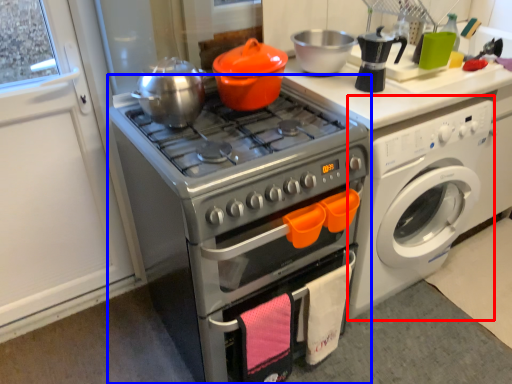
Question: Which of the following is the closest to the observer, washing machine (highlighted by a red box) or oven (highlighted by a blue box)?

Choices:
 (A) washing machine
 (B) oven

Answer: (B)